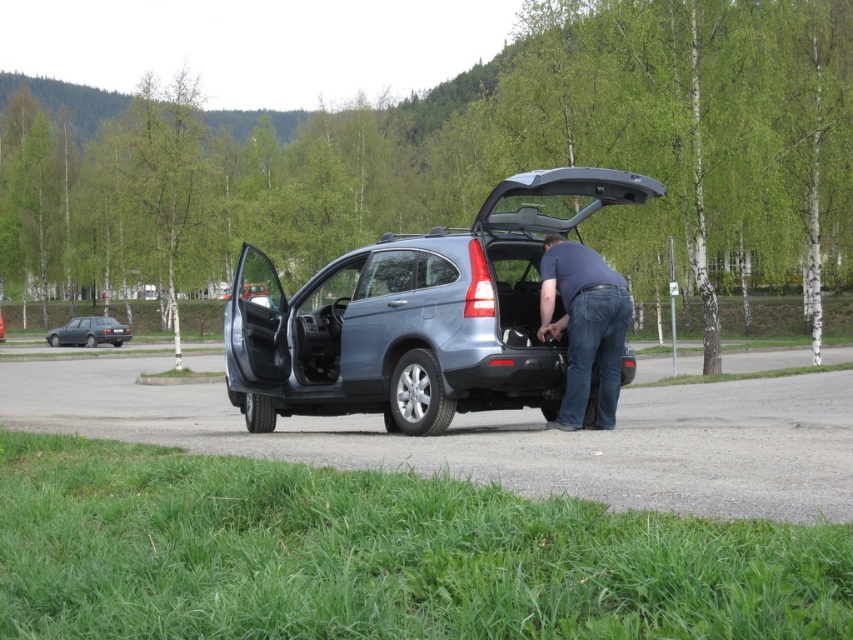
Does metallic blue suv at center appear over satin silver suv at center?

Correct, metallic blue suv at center is located above satin silver suv at center.

Does metallic blue suv at center have a lesser height compared to satin silver suv at center?

Indeed, metallic blue suv at center has a lesser height compared to satin silver suv at center.

Who is more forward, (x=271, y=298) or (x=3, y=337)?

Point (x=271, y=298) is in front.

Locate an element on the screen. The width and height of the screenshot is (853, 640). metallic blue suv at center is located at coordinates (416, 314).

Which is behind, point (602, 333) or point (0, 323)?

The point (0, 323) is behind.

Who is taller, dark blue shirt at center or satin silver suv at center?

With more height is dark blue shirt at center.

Where is `dark blue shirt at center`? The height and width of the screenshot is (640, 853). dark blue shirt at center is located at coordinates (584, 324).

Who is taller, metallic blue suv at center or dark gray metallic sedan at left?

dark gray metallic sedan at left is taller.

Is point (448, 408) positioned behind point (103, 316)?

No, (448, 408) is in front of (103, 316).

Does point (360, 371) lie in front of point (105, 323)?

Yes, point (360, 371) is in front of point (105, 323).

The width and height of the screenshot is (853, 640). I want to click on metallic blue suv at center, so click(x=416, y=314).